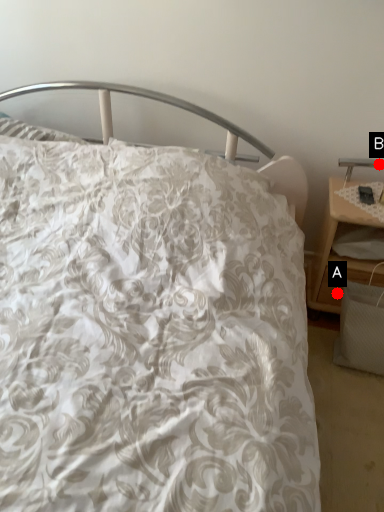
Question: Two points are circled on the image, labeled by A and B beside each circle. Which point is farther from the camera taking this photo?

Choices:
 (A) A is further
 (B) B is further

Answer: (B)